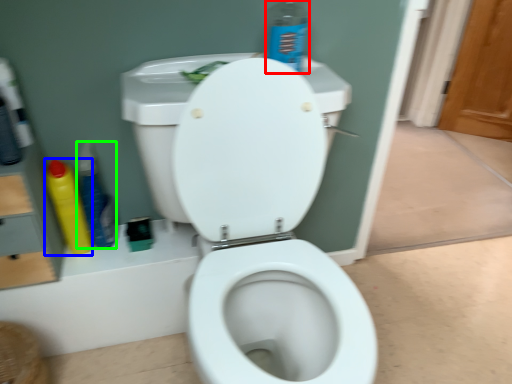
Question: Which object is the closest to the cleaning product (highlighted by a red box)? Choose among these: cleaning product (highlighted by a blue box) or cleaning product (highlighted by a green box).

Choices:
 (A) cleaning product
 (B) cleaning product

Answer: (B)